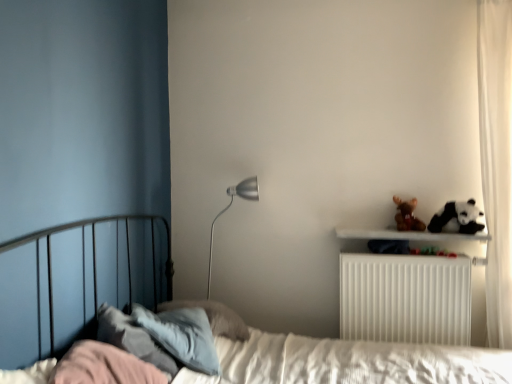
Question: Is white plastic radiator at upper right situated inside brown plush bear at upper right or outside?

Choices:
 (A) inside
 (B) outside

Answer: (B)

Question: From a real-world perspective, relative to brown plush bear at upper right, is white plastic radiator at upper right vertically above or below?

Choices:
 (A) below
 (B) above

Answer: (A)

Question: Which object is positioned farthest from the black and white plush panda at upper right?

Choices:
 (A) brown plush bear at upper right
 (B) white plastic radiator at upper right
 (C) silver metallic floor lamp at center
 (D) white sheer curtain at right
 (E) white quilted bed at center

Answer: (C)

Question: Which object is the closest to the white quilted bed at center?

Choices:
 (A) silver metallic floor lamp at center
 (B) brown plush bear at upper right
 (C) black and white plush panda at upper right
 (D) white plastic radiator at upper right
 (E) white sheer curtain at right

Answer: (D)